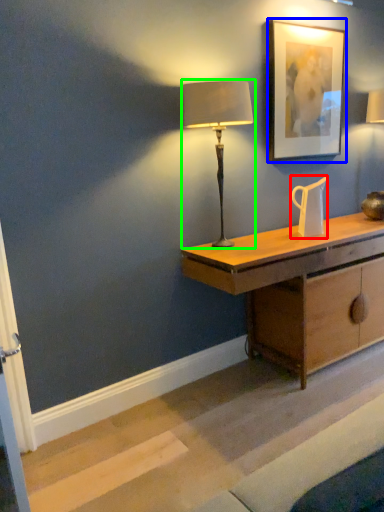
Question: Which object is the farthest from jug (highlighted by a red box)? Choose among these: picture frame (highlighted by a blue box) or lamp (highlighted by a green box).

Choices:
 (A) picture frame
 (B) lamp

Answer: (B)